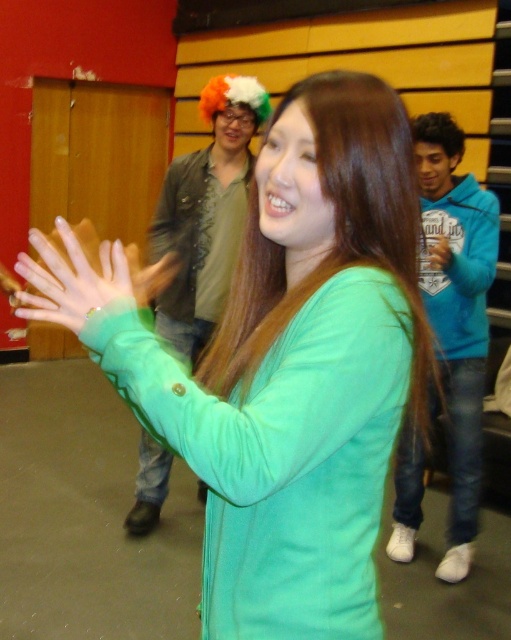
Question: Does teal smooth hair at center have a greater width compared to green matte hand at center?

Choices:
 (A) no
 (B) yes

Answer: (B)

Question: Which point is farther to the camera?

Choices:
 (A) (415, 230)
 (B) (466, 461)
 (C) (437, 252)

Answer: (B)

Question: Is teal smooth hair at center positioned at the back of shiny brown jacket at upper center?

Choices:
 (A) yes
 (B) no

Answer: (B)

Question: Which point appears closest to the camera in this image?

Choices:
 (A) (410, 304)
 (B) (230, 202)
 (C) (484, 307)

Answer: (A)

Question: Does shiny brown jacket at upper center have a lesser width compared to green matte hand at center?

Choices:
 (A) no
 (B) yes

Answer: (A)

Question: Based on their relative distances, which object is farther from the green matte hand at center?

Choices:
 (A) teal smooth hair at center
 (B) shiny brown jacket at upper center
 (C) blue fleece jacket at right
 (D) translucent plastic glove at center

Answer: (D)